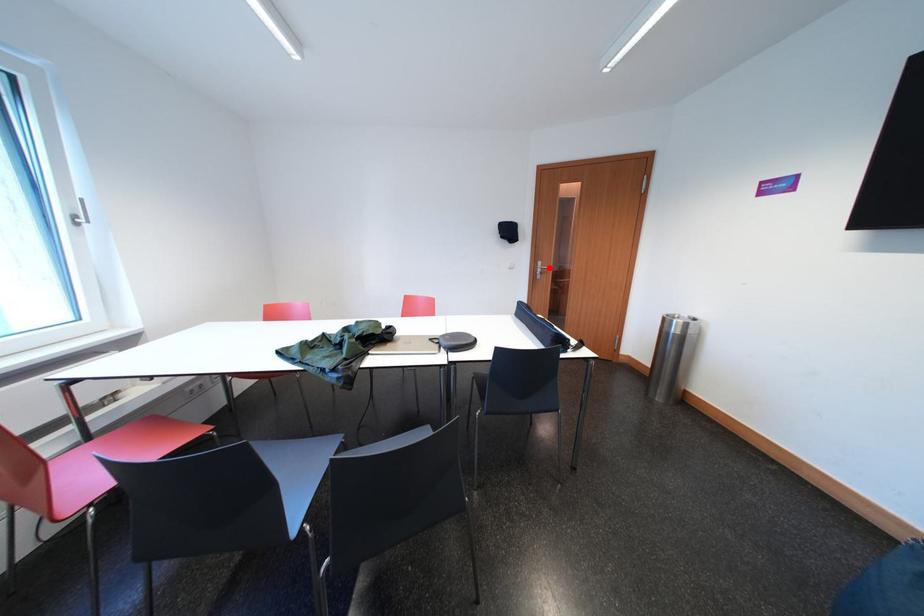
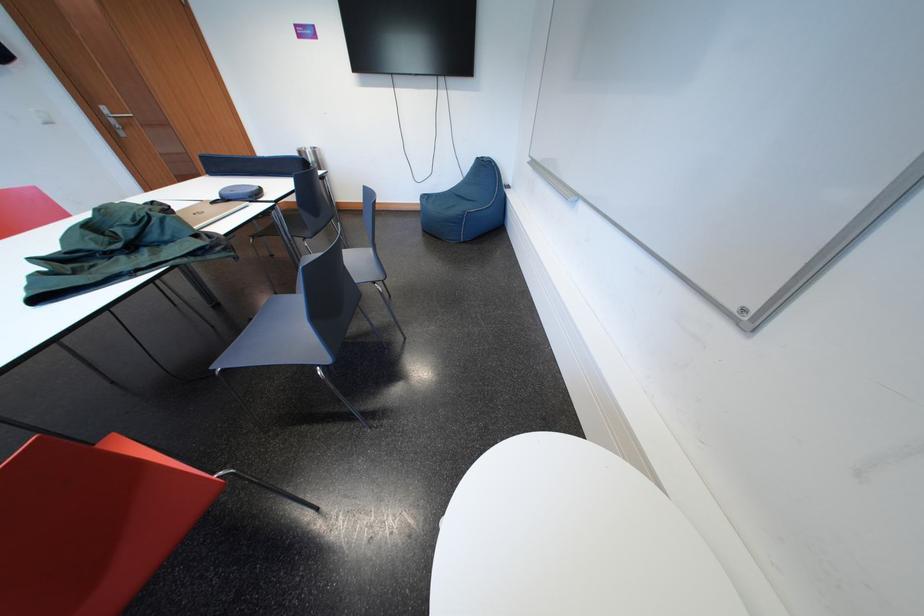
The point at the highlighted location is marked in the first image. Where is the corresponding point in the second image?

(113, 113)